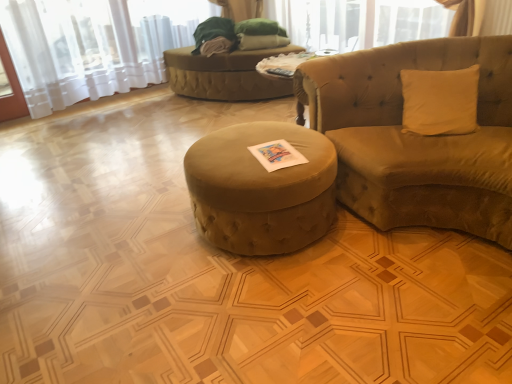
Question: Considering the relative sizes of velvet green ottoman at center and velvet beige studio couch at right in the image provided, is velvet green ottoman at center shorter than velvet beige studio couch at right?

Choices:
 (A) yes
 (B) no

Answer: (A)

Question: Is velvet green ottoman at center oriented towards velvet beige studio couch at right?

Choices:
 (A) yes
 (B) no

Answer: (B)

Question: Does velvet green ottoman at center have a greater height compared to velvet beige studio couch at right?

Choices:
 (A) no
 (B) yes

Answer: (A)

Question: From a real-world perspective, is velvet green ottoman at center beneath velvet beige studio couch at right?

Choices:
 (A) no
 (B) yes

Answer: (B)

Question: Considering the relative sizes of velvet green ottoman at center and velvet beige studio couch at right in the image provided, is velvet green ottoman at center bigger than velvet beige studio couch at right?

Choices:
 (A) no
 (B) yes

Answer: (A)

Question: Is velvet green ottoman at center outside of velvet beige studio couch at right?

Choices:
 (A) no
 (B) yes

Answer: (B)

Question: Is velvet beige studio couch at right beside velvet green ottoman at center?

Choices:
 (A) yes
 (B) no

Answer: (B)

Question: Does velvet beige studio couch at right appear on the left side of velvet green ottoman at center?

Choices:
 (A) no
 (B) yes

Answer: (A)

Question: Is velvet beige studio couch at right positioned behind velvet green ottoman at center?

Choices:
 (A) yes
 (B) no

Answer: (B)

Question: From a real-world perspective, is velvet beige studio couch at right over velvet green ottoman at center?

Choices:
 (A) no
 (B) yes

Answer: (B)

Question: From a real-world perspective, is velvet beige studio couch at right positioned under velvet green ottoman at center based on gravity?

Choices:
 (A) yes
 (B) no

Answer: (B)

Question: From the image's perspective, would you say velvet beige studio couch at right is positioned over velvet green ottoman at center?

Choices:
 (A) yes
 (B) no

Answer: (A)

Question: Is velvet beige studio couch at right positioned behind velvet green bean bag at center?

Choices:
 (A) no
 (B) yes

Answer: (A)